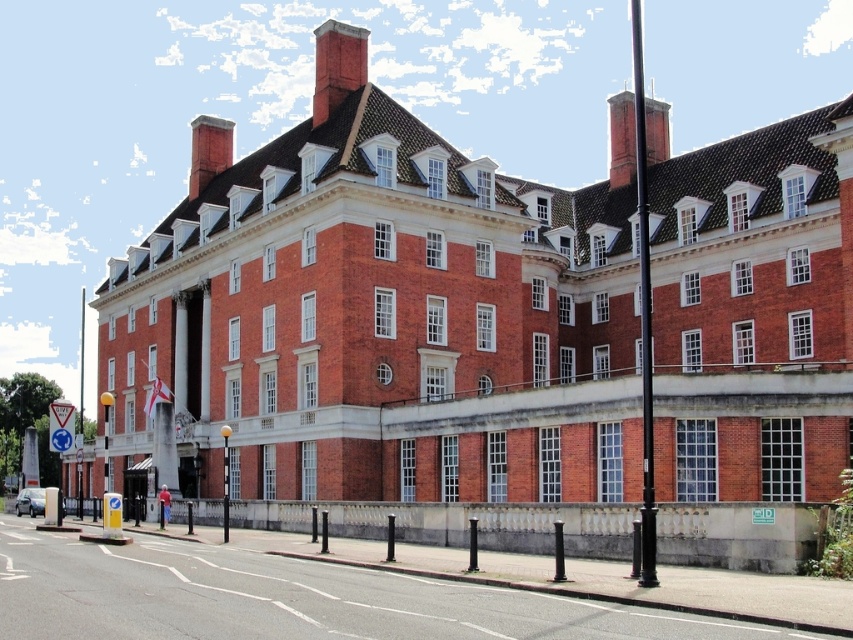
Consider the image. You are standing on the sidewalk in front of the building and want to walk towards the building. Which of the two points, point (350, 74) or point (619, 184), is closer to you as you approach the building?

Point (350, 74) is closer to the viewer than point (619, 184), so it will be closer to you as you approach the building.

In the scene shown: You are standing on the sidewalk in front of the building and notice two chimneys on the roof. Which chimney is located to the right of the other? The red brick chimney at upper right or the smooth brick chimney at upper center?

The red brick chimney at upper right is positioned on the right side of smooth brick chimney at upper center.